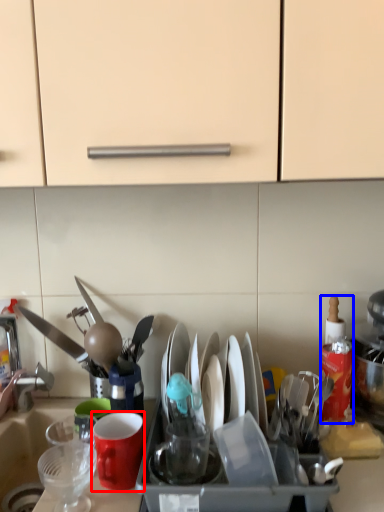
Question: Which point is closer to the camera, coffee cup (highlighted by a red box) or bottle (highlighted by a blue box)?

Choices:
 (A) coffee cup
 (B) bottle

Answer: (A)